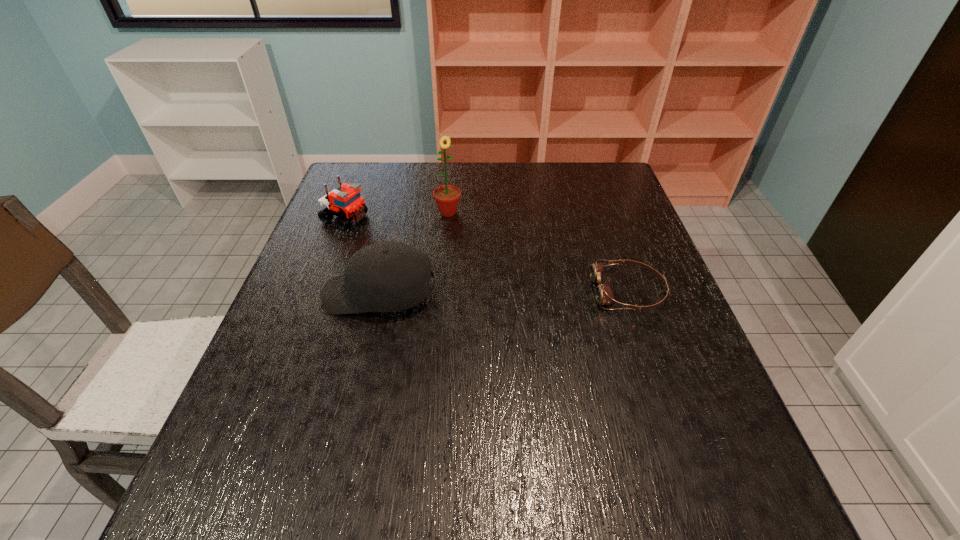
In the image, there is a desktop. Where is `vacant space at the right edge`? vacant space at the right edge is located at coordinates (631, 238).

In the image, there is a desktop. Where is `free region at the far left corner`? Image resolution: width=960 pixels, height=540 pixels. free region at the far left corner is located at coordinates (348, 168).

Where is `empty space that is in between the baseball cap and the rightmost object`? empty space that is in between the baseball cap and the rightmost object is located at coordinates (504, 293).

This screenshot has width=960, height=540. I want to click on vacant area between the rightmost object and the baseball cap, so click(504, 293).

You are a GUI agent. You are given a task and a screenshot of the screen. Output one action in this format:
    pyautogui.click(x=<x>, y=<y>)
    Task: Click on the empty location between the tallest object and the rightmost object
    This screenshot has height=540, width=960.
    Given the screenshot: What is the action you would take?
    pyautogui.click(x=539, y=252)

Locate an element on the screen. empty location between the Lego and the shortest object is located at coordinates point(487,255).

At what (x,y) coordinates should I click in order to perform the action: click on blank region between the goggles and the baseball cap. Please return your answer as a coordinate pair (x, y). The width and height of the screenshot is (960, 540). Looking at the image, I should click on (504, 293).

The image size is (960, 540). Identify the location of free space that is in between the rightmost object and the baseball cap. (504, 293).

Identify the location of free space between the baseball cap and the rightmost object. This screenshot has width=960, height=540. (504, 293).

Select which object is the third closest to the baseball cap. Please provide its 2D coordinates. Your answer should be formatted as a tuple, i.e. [(x, y)], where the tuple contains the x and y coordinates of a point satisfying the conditions above.

[(604, 294)]